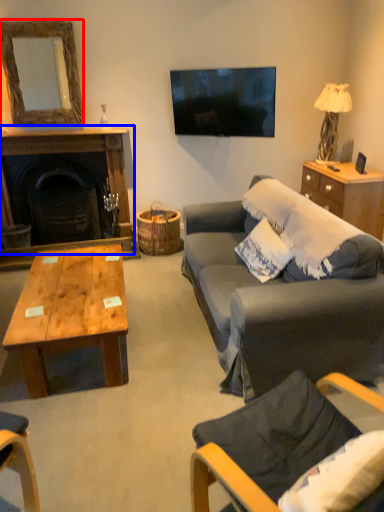
Question: Among these objects, which one is nearest to the camera, mirror (highlighted by a red box) or fireplace (highlighted by a blue box)?

Choices:
 (A) mirror
 (B) fireplace

Answer: (A)